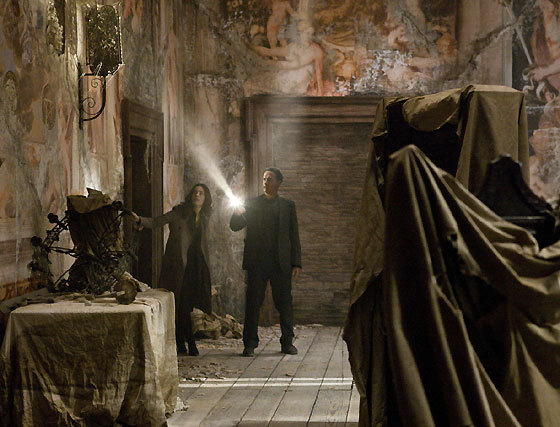
You are a GUI agent. You are given a task and a screenshot of the screen. Output one action in this format:
    pyautogui.click(x=<x>, y=<y>)
    Task: Click on the tablecloth
    
    Given the screenshot: What is the action you would take?
    (83, 351)